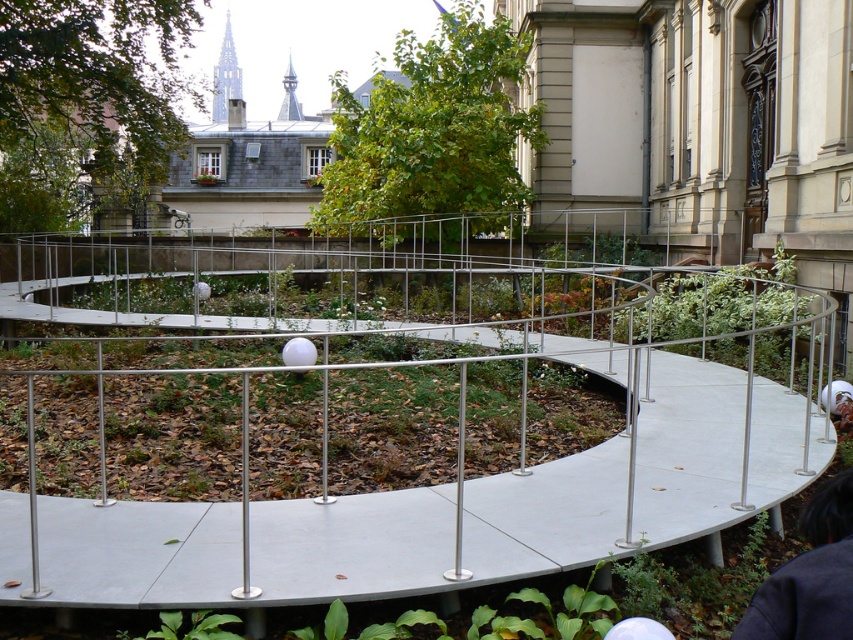
You are a delivery person carrying a package and need to walk from the dark blue fabric at lower right to the white matte helmet at center. Is the distance between them sufficient for you to comfortably carry the package without needing to adjust your path?

The distance between the dark blue fabric at lower right and the white matte helmet at center is 15.98 feet, which is more than enough for a delivery person to comfortably carry a package without needing to adjust their path.

You are standing at the point marked as point (384, 408) in the image. What object is located exactly at that point?

The metallic silver fence at center is located exactly at point (384, 408).

You are standing at the point closer to the camera between the two points, point (91, 420) and point (845, 416). Which point are you standing at?

You are standing at point (91, 420) because it is further to the camera than point (845, 416).